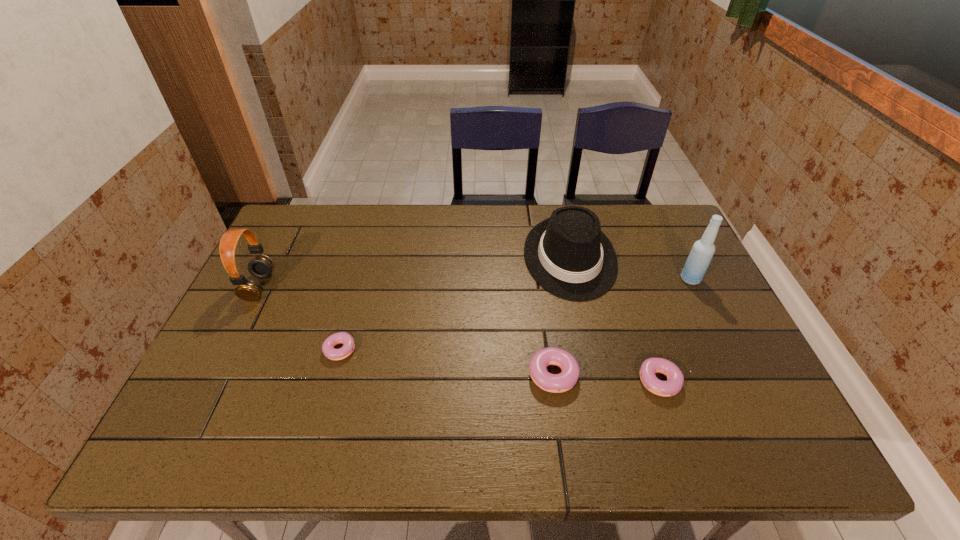
Identify the location of empty space that is in between the fifth object from right to left and the fifth tallest object. (503, 366).

Find the location of a particular element. vacant space that's between the rightmost doughnut and the fedora is located at coordinates (617, 320).

The width and height of the screenshot is (960, 540). Identify the location of free space between the tallest doughnut and the fifth tallest object. (609, 376).

Where is `vacant region between the second tallest object and the rightmost doughnut`? The width and height of the screenshot is (960, 540). vacant region between the second tallest object and the rightmost doughnut is located at coordinates (462, 334).

Where is `free space between the third tallest object and the tallest doughnut`? Image resolution: width=960 pixels, height=540 pixels. free space between the third tallest object and the tallest doughnut is located at coordinates (562, 314).

This screenshot has width=960, height=540. Identify the location of free space between the second object from left to right and the rightmost doughnut. (503, 366).

Locate an element on the screen. Image resolution: width=960 pixels, height=540 pixels. the fifth closest object to the fedora is located at coordinates (261, 266).

At what (x,y) coordinates should I click in order to perform the action: click on the closest object relative to the fedora. Please return your answer as a coordinate pair (x, y). Image resolution: width=960 pixels, height=540 pixels. Looking at the image, I should click on click(556, 383).

The image size is (960, 540). Identify the location of the closest doughnut to the fedora. (556, 383).

This screenshot has width=960, height=540. Find the location of `doughnut that stands as the second closest to the fedora`. doughnut that stands as the second closest to the fedora is located at coordinates (675, 379).